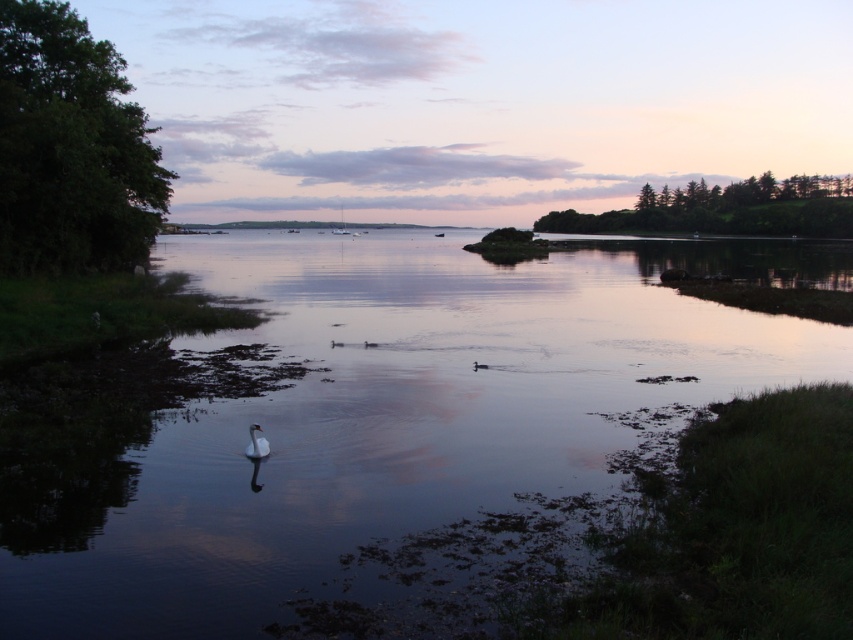
You are an artist planning to paint the lakeside scene. You want to ensure the white glossy swan at lower center is proportionally accurate compared to the clear water at center. Based on the scene, which object should you make larger in your painting?

The clear water at center should be made larger in the painting since it is bigger than the white glossy swan at lower center in the scene.

You are standing at the lakeside and want to take a photo of the green leafy tree at left and the green leafy trees at upper right. Which tree group will appear closer to you in the photo?

The green leafy tree at left appears closer to you in the photo because it is positioned in front of the green leafy trees at upper right.